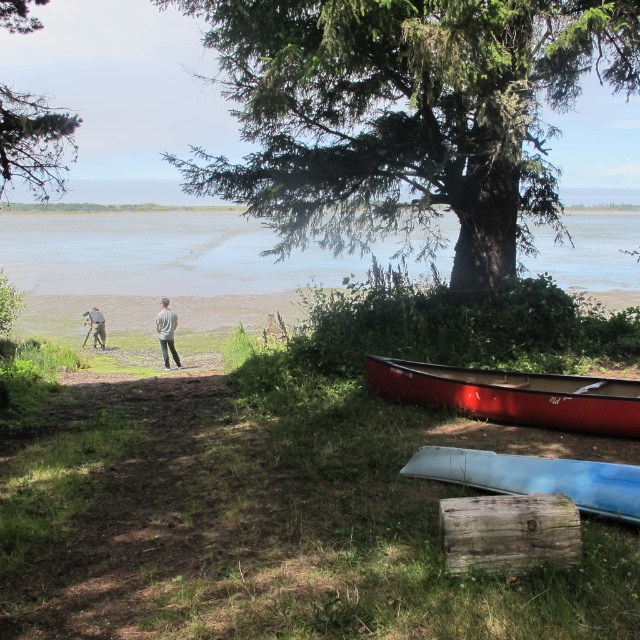
This screenshot has width=640, height=640. What do you see at coordinates (404, 116) in the screenshot? I see `green textured tree at upper center` at bounding box center [404, 116].

Does green textured tree at upper center have a lesser width compared to light brown leather jacket at center?

No.

Between point (348, 35) and point (92, 316), which one is positioned in front?

Point (348, 35) is more forward.

Locate an element on the screen. green textured tree at upper center is located at coordinates (404, 116).

This screenshot has height=640, width=640. What are the coordinates of `green textured tree at upper center` in the screenshot? It's located at (404, 116).

Locate an element on the screen. This screenshot has width=640, height=640. green textured tree at upper center is located at coordinates (404, 116).

Is brown sandy water at center positioned in front of light brown leather jacket at center?

No, it is not.

Identify the location of brown sandy water at center. (156, 269).

I want to click on brown sandy water at center, so click(156, 269).